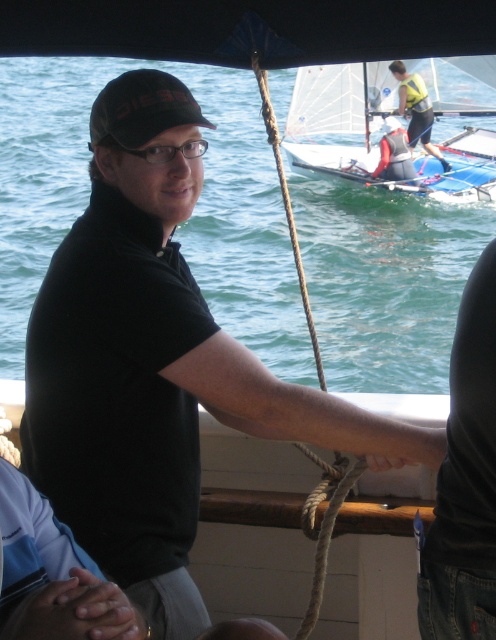
Which of these two, roperoughrope at center or black matte baseball cap at upper left, stands taller?

roperoughrope at center

Does roperoughrope at center appear over black matte baseball cap at upper left?

No.

Consider the image. Who is more distant from viewer, (263, 80) or (136, 120)?

The point (263, 80) is behind.

Locate an element on the screen. The height and width of the screenshot is (640, 496). roperoughrope at center is located at coordinates (323, 522).

Is roperoughrope at center to the right of yellow life vest at upper right from the viewer's perspective?

No, roperoughrope at center is not to the right of yellow life vest at upper right.

Identify the location of roperoughrope at center. (323, 522).

Which is in front, point (307, 310) or point (416, 134)?

Point (307, 310) is more forward.

You are a GUI agent. You are given a task and a screenshot of the screen. Output one action in this format:
    pyautogui.click(x=<x>, y=<y>)
    Task: Click on the roperoughrope at center
    The image size is (496, 640).
    Given the screenshot: What is the action you would take?
    pyautogui.click(x=323, y=522)

Is yellow life vest at upper right above smooth skin hand at center?

Yes.

You are a GUI agent. You are given a task and a screenshot of the screen. Output one action in this format:
    pyautogui.click(x=<x>, y=<y>)
    Task: Click on the yellow life vest at upper right
    This screenshot has height=640, width=496.
    Given the screenshot: What is the action you would take?
    pyautogui.click(x=416, y=109)